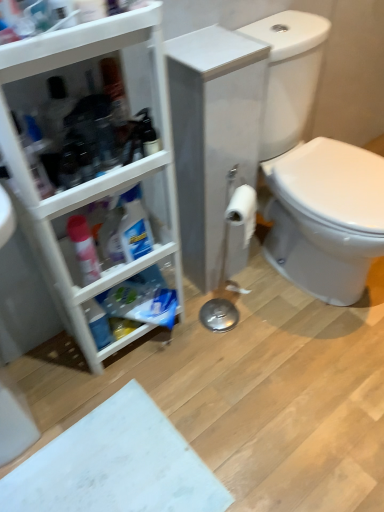
You are a GUI agent. You are given a task and a screenshot of the screen. Output one action in this format:
    pyautogui.click(x=<x>, y=<y>)
    Task: Click on the free space that is in between white glossy toilet at right and white plastic cabinet at left
    
    Given the screenshot: What is the action you would take?
    pyautogui.click(x=235, y=332)